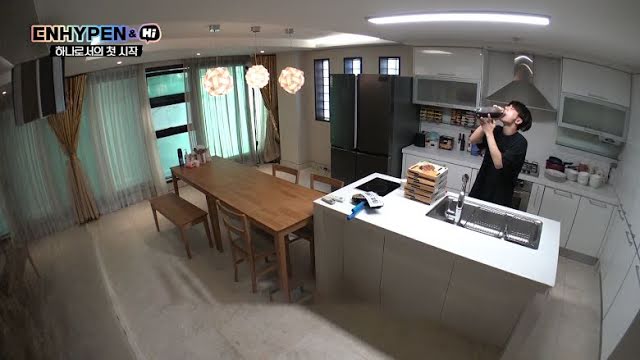
Locate an element on the screen. This screenshot has width=640, height=360. windows is located at coordinates (172, 119).